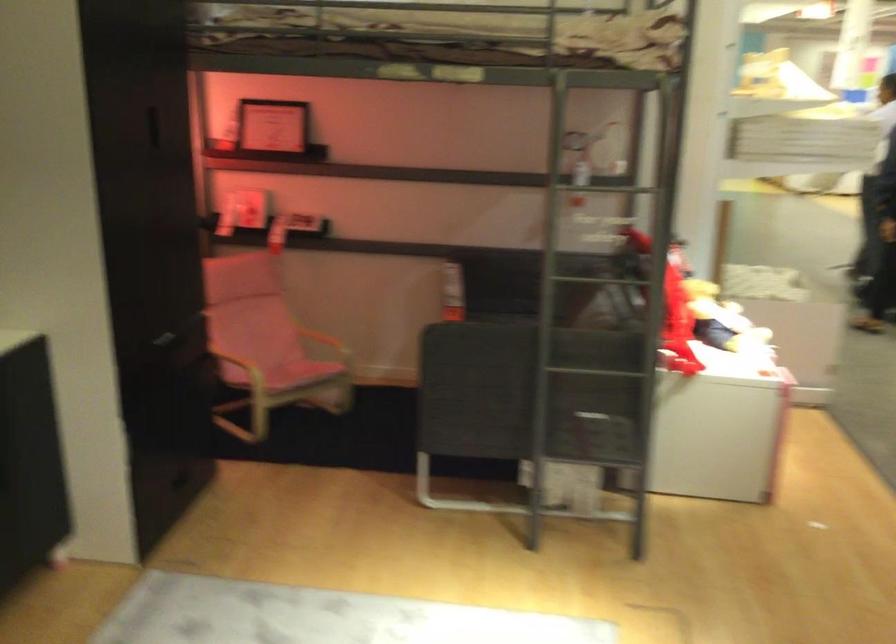
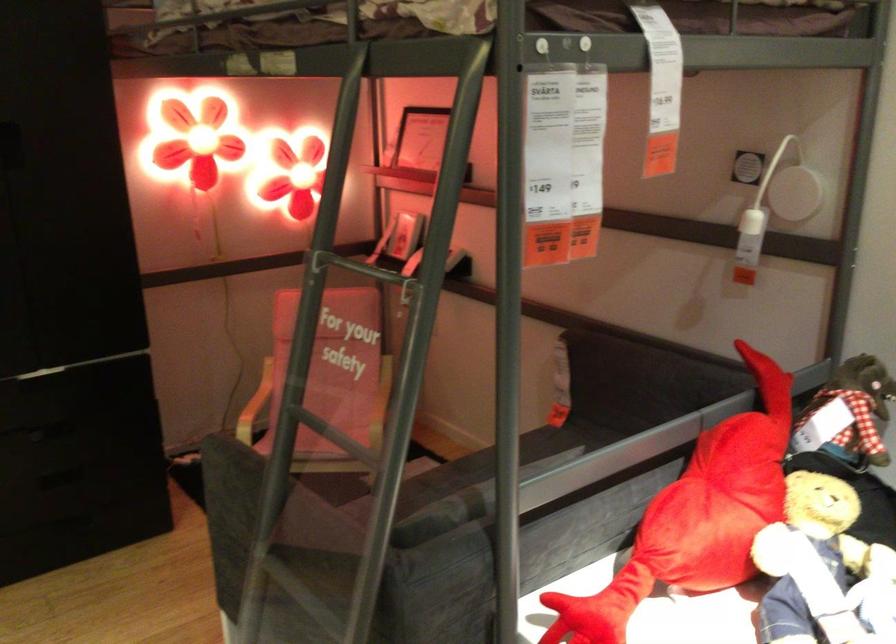
Where in the second image is the point corresponding to point 280,346 from the first image?

(331, 404)